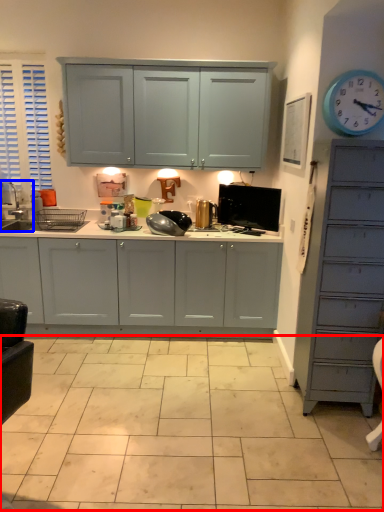
Question: Which object is further to the camera taking this photo, ceramic tile (highlighted by a red box) or sink (highlighted by a blue box)?

Choices:
 (A) ceramic tile
 (B) sink

Answer: (B)